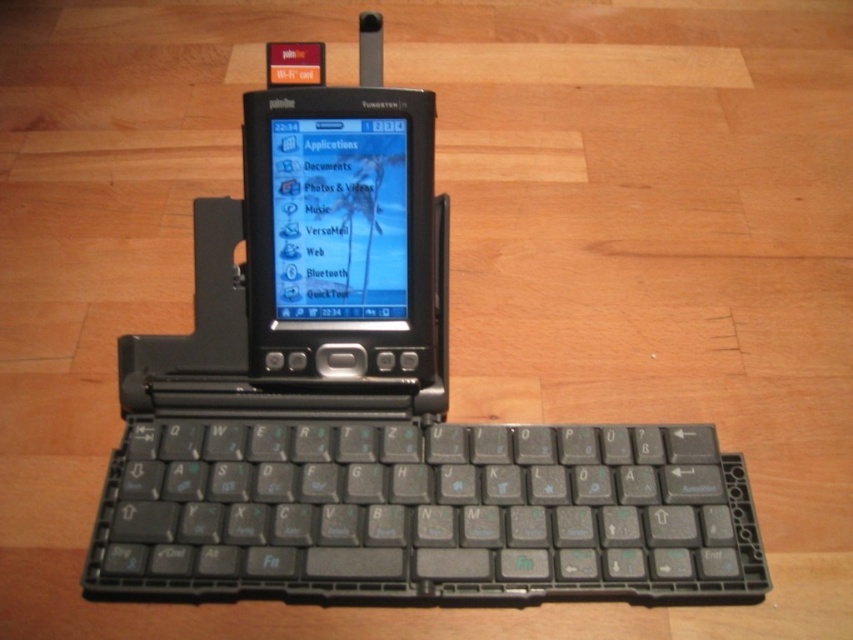
Question: Which point is farther to the camera?

Choices:
 (A) (555, 481)
 (B) (305, 300)

Answer: (B)

Question: Observing the image, what is the correct spatial positioning of black plastic keyboard at center in reference to matte plastic screen at center?

Choices:
 (A) above
 (B) below

Answer: (B)

Question: Which object appears farthest from the camera in this image?

Choices:
 (A) matte plastic screen at center
 (B) black plastic keyboard at center

Answer: (A)

Question: Does black plastic keyboard at center have a greater width compared to matte plastic screen at center?

Choices:
 (A) yes
 (B) no

Answer: (A)

Question: Can you confirm if black plastic keyboard at center is bigger than matte plastic screen at center?

Choices:
 (A) no
 (B) yes

Answer: (B)

Question: Which point is closer to the camera?

Choices:
 (A) (334, 148)
 (B) (608, 436)

Answer: (B)